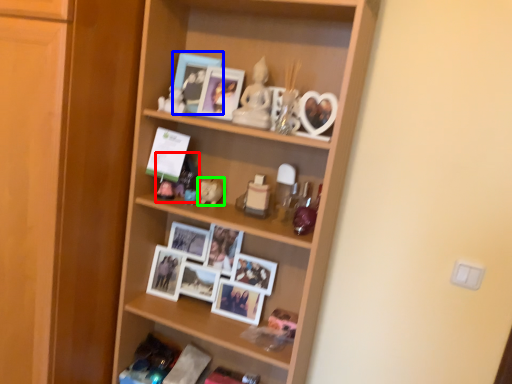
Question: Considering the real-world distances, which object is closest to toy (highlighted by a red box)? picture frame (highlighted by a blue box) or toy (highlighted by a green box).

Choices:
 (A) picture frame
 (B) toy

Answer: (B)